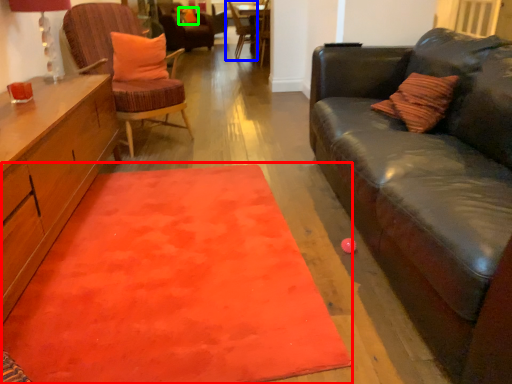
Question: Which object is the closest to the mat (highlighted by a red box)? Choose among these: chair (highlighted by a blue box) or pillow (highlighted by a green box).

Choices:
 (A) chair
 (B) pillow

Answer: (A)